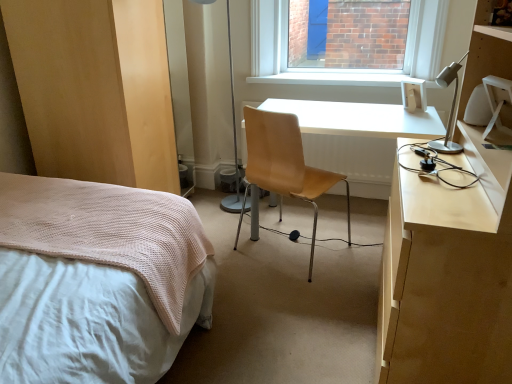
Where is `free spot below light brown leather chair at center (from a real-world perspective)`? This screenshot has height=384, width=512. free spot below light brown leather chair at center (from a real-world perspective) is located at coordinates (283, 261).